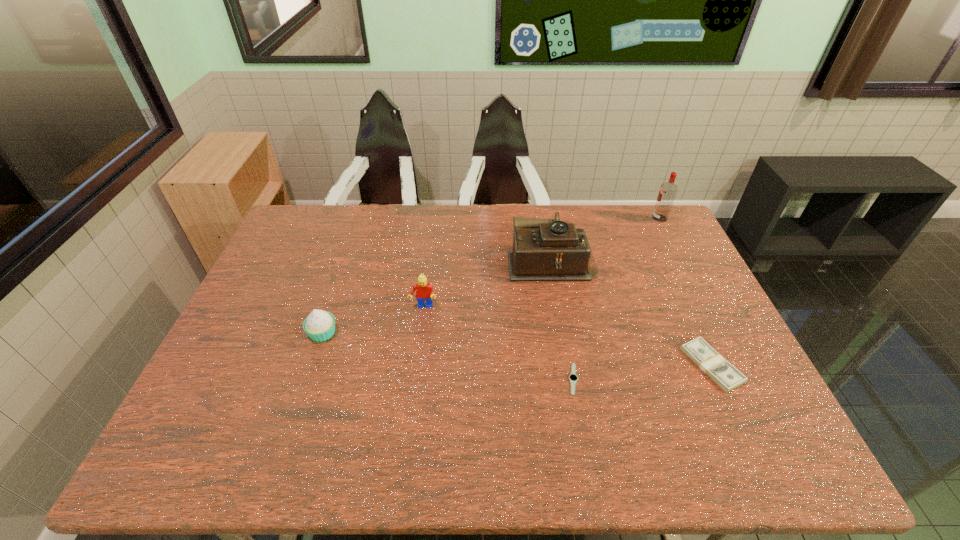
Identify the location of vodka present at the far edge. This screenshot has height=540, width=960. (668, 190).

Where is `phonograph_record that is at the far edge`? The height and width of the screenshot is (540, 960). phonograph_record that is at the far edge is located at coordinates (543, 249).

Where is `vodka that is at the right edge`? vodka that is at the right edge is located at coordinates (668, 190).

I want to click on dollar that is at the right edge, so click(726, 376).

Locate an element on the screen. The height and width of the screenshot is (540, 960). object present at the far right corner is located at coordinates (668, 190).

This screenshot has height=540, width=960. Find the location of `free space at the far edge`. free space at the far edge is located at coordinates (394, 231).

Where is `vacant space at the near edge of the desktop`? vacant space at the near edge of the desktop is located at coordinates (521, 456).

In the image, there is a desktop. Identify the location of free space at the left edge. (256, 386).

I want to click on free space at the right edge of the desktop, so click(679, 328).

At what (x,y) coordinates should I click in order to perform the action: click on vacant space at the far left corner of the desktop. Please return your answer as a coordinate pair (x, y). This screenshot has height=540, width=960. Looking at the image, I should click on (310, 238).